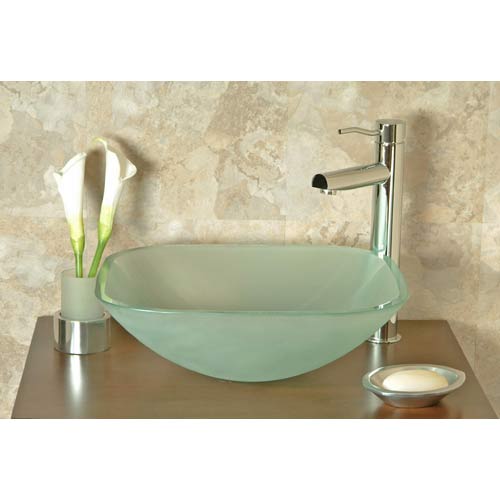
Where is `switch`? switch is located at coordinates (355, 129).